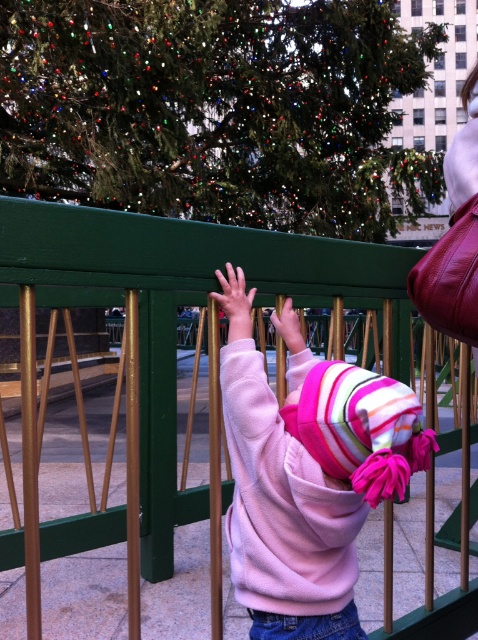
Question: From the image, what is the correct spatial relationship of green textured christmas tree at upper center in relation to pink fleece sweatshirt at center?

Choices:
 (A) left
 (B) right

Answer: (B)

Question: Which object appears farthest from the camera in this image?

Choices:
 (A) green painted metal fence at upper center
 (B) pink fleece sweatshirt at center

Answer: (B)

Question: Which is farther from the green painted metal fence at upper center?

Choices:
 (A) pink fleece sweatshirt at center
 (B) green textured christmas tree at upper center

Answer: (B)

Question: Is green textured christmas tree at upper center bigger than green painted metal fence at upper center?

Choices:
 (A) no
 (B) yes

Answer: (B)

Question: Is green textured christmas tree at upper center smaller than pink fleece sweatshirt at center?

Choices:
 (A) no
 (B) yes

Answer: (A)

Question: Based on their relative distances, which object is nearer to the green textured christmas tree at upper center?

Choices:
 (A) pink fleece sweatshirt at center
 (B) green painted metal fence at upper center

Answer: (B)